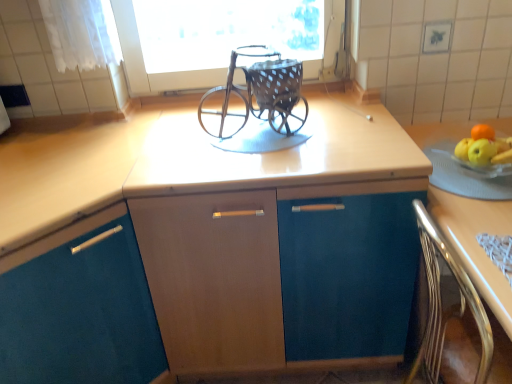
Question: Is metallic polished chair at lower right closer to camera compared to light brown wood at right?

Choices:
 (A) yes
 (B) no

Answer: (A)

Question: From a real-world perspective, is metallic polished chair at lower right below light brown wood at right?

Choices:
 (A) yes
 (B) no

Answer: (B)

Question: From a real-world perspective, is metallic polished chair at lower right physically above light brown wood at right?

Choices:
 (A) yes
 (B) no

Answer: (A)

Question: Is metallic polished chair at lower right positioned with its back to light brown wood at right?

Choices:
 (A) yes
 (B) no

Answer: (A)

Question: Is metallic polished chair at lower right smaller than light brown wood at right?

Choices:
 (A) no
 (B) yes

Answer: (B)

Question: Is metallic polished chair at lower right next to light brown wood at right?

Choices:
 (A) yes
 (B) no

Answer: (B)

Question: Would you say metallic polished chair at lower right is a long distance from matte wood cabinet at center, the second cabinetry viewed from the left?

Choices:
 (A) yes
 (B) no

Answer: (B)

Question: From the image's perspective, is metallic polished chair at lower right beneath matte wood cabinet at center, the second cabinetry viewed from the left?

Choices:
 (A) no
 (B) yes

Answer: (B)

Question: Would you say matte wood cabinet at center, acting as the first cabinetry starting from the right, is part of metallic polished chair at lower right's contents?

Choices:
 (A) yes
 (B) no

Answer: (B)

Question: From a real-world perspective, is metallic polished chair at lower right on matte wood cabinet at center, acting as the first cabinetry starting from the right?

Choices:
 (A) yes
 (B) no

Answer: (A)

Question: Could you tell me if metallic polished chair at lower right is facing matte wood cabinet at center, acting as the first cabinetry starting from the right?

Choices:
 (A) no
 (B) yes

Answer: (A)

Question: From a real-world perspective, is metallic polished chair at lower right below matte wood cabinet at center, the second cabinetry viewed from the left?

Choices:
 (A) no
 (B) yes

Answer: (A)

Question: Is there a large distance between matte wood cabinet at center, acting as the first cabinetry starting from the right, and light brown wood at right?

Choices:
 (A) no
 (B) yes

Answer: (A)